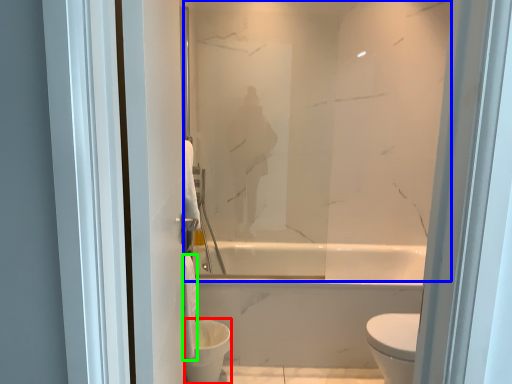
Question: Based on their relative distances, which object is nearer to toilet bowl (highlighted by a red box)? Choose from mirror (highlighted by a blue box) and toilet paper (highlighted by a green box).

Choices:
 (A) mirror
 (B) toilet paper

Answer: (B)